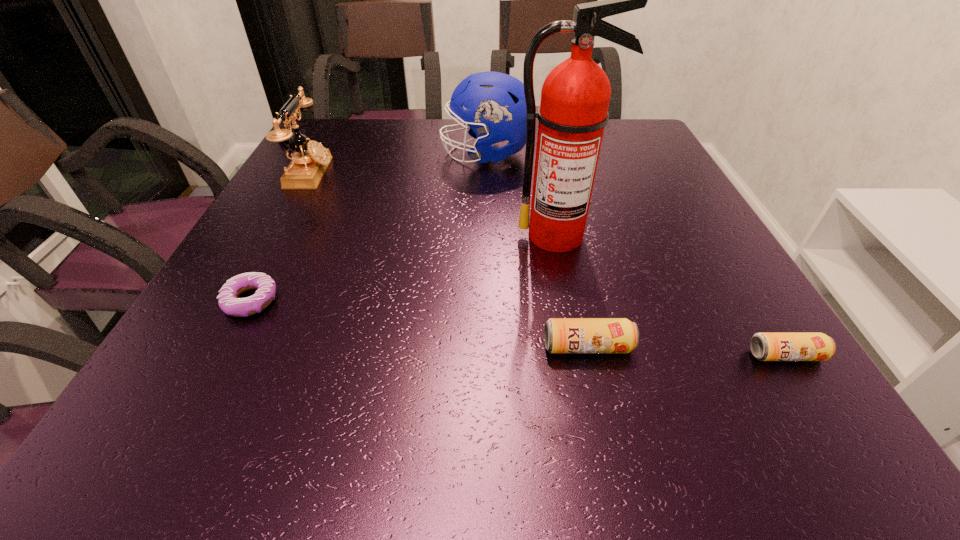
At what (x,y) coordinates should I click in order to perform the action: click on vacant space located 0.320m on the left of the left beer can. Please return your answer as a coordinate pair (x, y). This screenshot has height=540, width=960. Looking at the image, I should click on (344, 347).

Locate an element on the screen. The image size is (960, 540). vacant space positioned on the left of the shorter beer can is located at coordinates (598, 355).

Where is `vacant space located 0.290m on the front-facing side of the football helmet`? vacant space located 0.290m on the front-facing side of the football helmet is located at coordinates (332, 154).

The height and width of the screenshot is (540, 960). I want to click on vacant region located 0.050m on the front-facing side of the football helmet, so click(422, 154).

The height and width of the screenshot is (540, 960). I want to click on free space located 0.090m on the front-facing side of the football helmet, so click(407, 154).

Locate an element on the screen. Image resolution: width=960 pixels, height=540 pixels. vacant space situated on the dial of the fourth shortest object is located at coordinates (379, 173).

The image size is (960, 540). In order to click on vacant space situated on the back of the fourth farthest object in this screenshot , I will do `click(300, 208)`.

In order to click on free space located 0.280m on the side of the third farthest object near the handle in this screenshot , I will do `click(585, 373)`.

Locate an element on the screen. This screenshot has width=960, height=540. football helmet present at the far edge is located at coordinates (497, 108).

This screenshot has height=540, width=960. What are the coordinates of `telephone present at the far edge` in the screenshot? It's located at (309, 162).